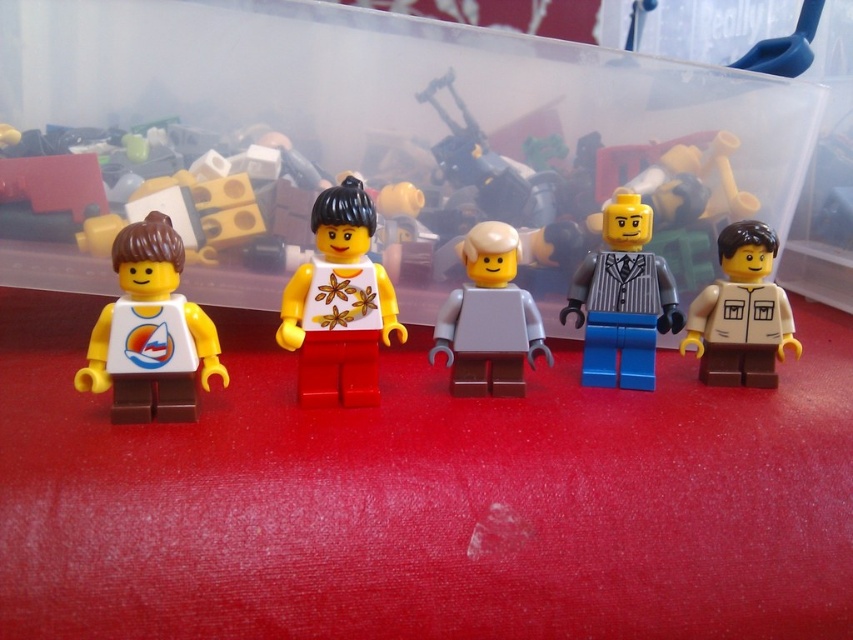
Based on the photo, you are a toy organizer who needs to place a 10 inch wide box between the matte white shirt at left and the light gray matte minifigure at center. Can you fit it in the available space?

The distance between the matte white shirt at left and the light gray matte minifigure at center is 12.81 inches, so yes, the 10 inch wide box can fit between them.

You are a LEGO collector trying to arrange these minifigures in a row. If you want to place the matte white shirt at left to the right of the light gray matte minifigure at center, would that be possible based on their current positions?

The matte white shirt at left is currently positioned on the left side of the light gray matte minifigure at center. To place the matte white shirt at left to the right of the light gray matte minifigure at center, you would need to move them, as their current arrangement has the matte white shirt at left on the left side.

You are holding a camera and want to take a photo of the light gray matte minifigure at center. The camera has a minimum focusing distance of 30 inches. Can you take a clear photo without moving the camera or the minifigure?

The light gray matte minifigure at center and camera are 32.79 inches apart from each other, so yes, you can take a clear photo since the distance is within the camera minimum focusing distance of 30 inches.